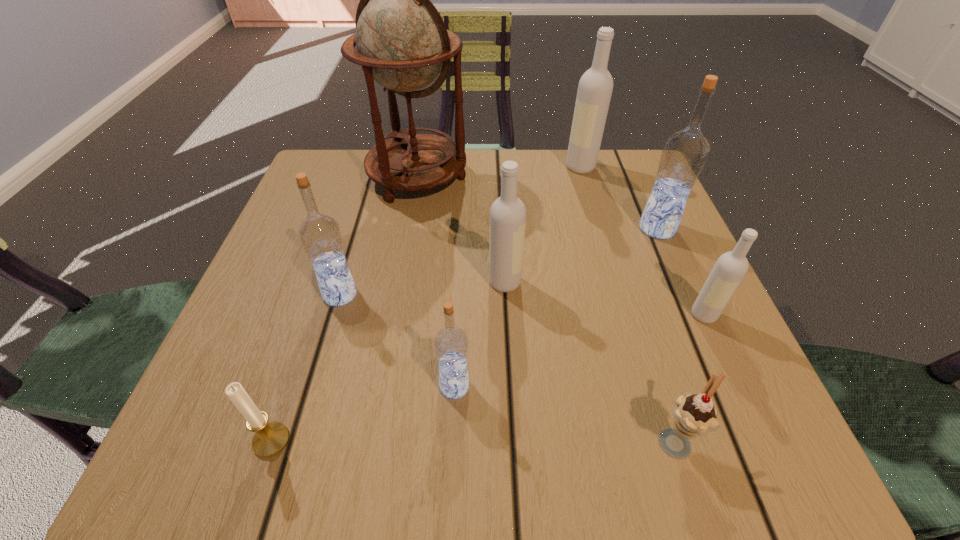
Where is `vacant space located 0.330m on the left of the rightmost white vodka`? The height and width of the screenshot is (540, 960). vacant space located 0.330m on the left of the rightmost white vodka is located at coordinates (491, 315).

I want to click on vacant space situated on the left of the nearest blue vodka, so tap(391, 386).

What are the coordinates of `free space located 0.140m on the right of the candle holder` in the screenshot? It's located at (396, 441).

The width and height of the screenshot is (960, 540). In order to click on blank space located 0.140m on the left of the icecream in this screenshot , I will do `click(546, 440)`.

Locate an element on the screen. The height and width of the screenshot is (540, 960). globe that is at the far edge is located at coordinates (402, 43).

Locate an element on the screen. vodka at the far edge is located at coordinates (595, 87).

At what (x,y) coordinates should I click in order to perform the action: click on candle holder located in the near edge section of the desktop. Please return your answer as a coordinate pair (x, y). The height and width of the screenshot is (540, 960). Looking at the image, I should click on (269, 439).

Where is `icecream present at the near edge`? This screenshot has height=540, width=960. icecream present at the near edge is located at coordinates (694, 415).

You are a GUI agent. You are given a task and a screenshot of the screen. Output one action in this format:
    pyautogui.click(x=<x>, y=<y>)
    Task: Click on the globe present at the left edge
    The width and height of the screenshot is (960, 540).
    Given the screenshot: What is the action you would take?
    pyautogui.click(x=402, y=43)

Find the location of `vodka at the left edge`. vodka at the left edge is located at coordinates (320, 235).